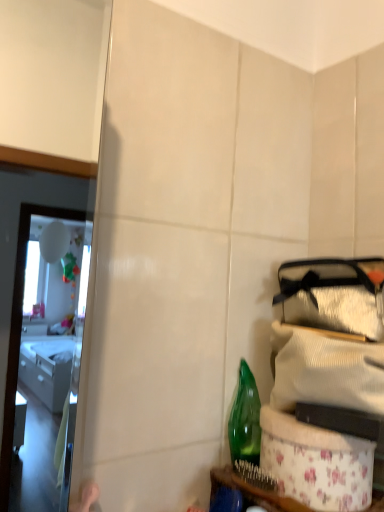
Where is `green glass bottle at lower right`? Image resolution: width=384 pixels, height=512 pixels. green glass bottle at lower right is located at coordinates (245, 419).

This screenshot has width=384, height=512. Describe the element at coordinates (245, 419) in the screenshot. I see `green glass bottle at lower right` at that location.

What is the approximate height of green glass bottle at lower right?

green glass bottle at lower right is 6.21 inches tall.

What do you see at coordinates (252, 492) in the screenshot? I see `floral fabric basket at lower right` at bounding box center [252, 492].

At what (x,y) coordinates should I click in order to perform the action: click on floral fabric basket at lower right. Please return your answer as a coordinate pair (x, y). The image size is (384, 512). Looking at the image, I should click on (252, 492).

In order to click on green glass bottle at lower right in this screenshot , I will do `click(245, 419)`.

Would you say floral fabric basket at lower right is to the left or to the right of green glass bottle at lower right in the picture?

floral fabric basket at lower right is to the right of green glass bottle at lower right.

Which object is more forward, floral fabric basket at lower right or green glass bottle at lower right?

Positioned in front is floral fabric basket at lower right.

Which is less distant, (216, 475) or (233, 429)?

Point (216, 475) appears to be closer to the viewer than point (233, 429).

From the image's perspective, is floral fabric basket at lower right over green glass bottle at lower right?

No, from the image's perspective, floral fabric basket at lower right is not on top of green glass bottle at lower right.

From a real-world perspective, is floral fabric basket at lower right above or below green glass bottle at lower right?

From a real-world perspective, floral fabric basket at lower right is physically below green glass bottle at lower right.

Does floral fabric basket at lower right have a greater width compared to green glass bottle at lower right?

Yes.

Which of these two, floral fabric basket at lower right or green glass bottle at lower right, stands taller?

green glass bottle at lower right.

Which of these two, floral fabric basket at lower right or green glass bottle at lower right, is bigger?

floral fabric basket at lower right.

Is green glass bottle at lower right completely or partially inside floral fabric basket at lower right?

No, green glass bottle at lower right is not surrounded by floral fabric basket at lower right.

Are floral fabric basket at lower right and green glass bottle at lower right far apart?

They are positioned close to each other.

Is floral fabric basket at lower right looking in the opposite direction of green glass bottle at lower right?

No, floral fabric basket at lower right is not facing away from green glass bottle at lower right.

Can you tell me how much floral fabric basket at lower right and green glass bottle at lower right differ in facing direction?

floral fabric basket at lower right and green glass bottle at lower right are facing 0.00255 degrees away from each other.

Find the location of a particular element. This screenshot has width=384, height=512. furniture on the right of the green glass bottle at lower right is located at coordinates (252, 492).

Which object is positioned more to the right, green glass bottle at lower right or floral fabric basket at lower right?

Positioned to the right is floral fabric basket at lower right.

Is the depth of green glass bottle at lower right greater than that of floral fabric basket at lower right?

Yes, green glass bottle at lower right is behind floral fabric basket at lower right.

Which is more distant, (x=247, y=374) or (x=377, y=500)?

The point (x=247, y=374) is more distant.

From the image's perspective, which is above, green glass bottle at lower right or floral fabric basket at lower right?

green glass bottle at lower right.

From a real-world perspective, which is physically below, green glass bottle at lower right or floral fabric basket at lower right?

In real-world perspective, floral fabric basket at lower right is lower.

Considering the sizes of objects green glass bottle at lower right and floral fabric basket at lower right in the image provided, who is thinner, green glass bottle at lower right or floral fabric basket at lower right?

green glass bottle at lower right is thinner.

Is green glass bottle at lower right taller or shorter than floral fabric basket at lower right?

green glass bottle at lower right is taller than floral fabric basket at lower right.

Between green glass bottle at lower right and floral fabric basket at lower right, which one has smaller size?

Smaller between the two is green glass bottle at lower right.

Is green glass bottle at lower right located outside floral fabric basket at lower right?

Yes, green glass bottle at lower right is not within floral fabric basket at lower right.

Is green glass bottle at lower right not near floral fabric basket at lower right?

green glass bottle at lower right is actually quite close to floral fabric basket at lower right.

Is green glass bottle at lower right positioned with its back to floral fabric basket at lower right?

No, green glass bottle at lower right's orientation is not away from floral fabric basket at lower right.

The height and width of the screenshot is (512, 384). Identify the location of bottle above the floral fabric basket at lower right (from the image's perspective). (245, 419).

Locate an element on the screen. Image resolution: width=384 pixels, height=512 pixels. bottle on the left of floral fabric basket at lower right is located at coordinates (245, 419).

What are the coordinates of `furniture located on the right of green glass bottle at lower right` in the screenshot? It's located at (252, 492).